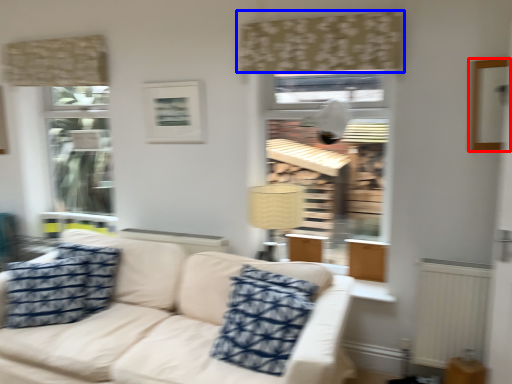
Question: Which object appears farthest to the camera in this image, picture frame (highlighted by a red box) or curtain (highlighted by a blue box)?

Choices:
 (A) picture frame
 (B) curtain

Answer: (B)